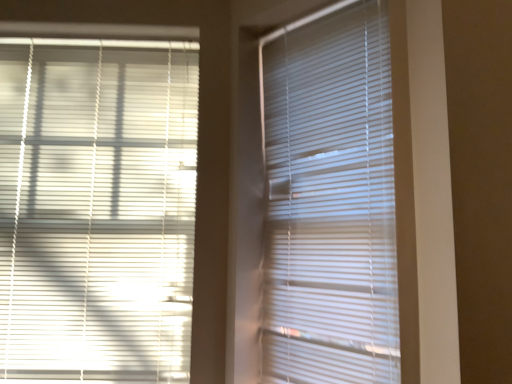
I want to click on white matte blinds at left, the 1th window blind viewed from the left, so click(97, 208).

What do you see at coordinates (97, 208) in the screenshot? I see `white matte blinds at left, the 2th window blind from the right` at bounding box center [97, 208].

How much space does white matte window blind at center, acting as the first window blind starting from the right, occupy horizontally?

It is 0.98 inches.

Locate an element on the screen. The height and width of the screenshot is (384, 512). white matte window blind at center, acting as the first window blind starting from the right is located at coordinates pos(330,201).

How much space does white matte window blind at center, which is counted as the second window blind, starting from the left, occupy vertically?

The height of white matte window blind at center, which is counted as the second window blind, starting from the left, is 5.05 feet.

This screenshot has width=512, height=384. What do you see at coordinates (330, 201) in the screenshot?
I see `white matte window blind at center, acting as the first window blind starting from the right` at bounding box center [330, 201].

At what (x,y) coordinates should I click in order to perform the action: click on white matte blinds at left, the 2th window blind from the right. Please return your answer as a coordinate pair (x, y). The width and height of the screenshot is (512, 384). Looking at the image, I should click on (97, 208).

Which is more to the left, white matte blinds at left, the 2th window blind from the right, or white matte window blind at center, which is counted as the second window blind, starting from the left?

Positioned to the left is white matte blinds at left, the 2th window blind from the right.

In the image, is white matte blinds at left, the 2th window blind from the right, positioned in front of or behind white matte window blind at center, which is counted as the second window blind, starting from the left?

Clearly, white matte blinds at left, the 2th window blind from the right, is behind white matte window blind at center, which is counted as the second window blind, starting from the left.

Considering the positions of point (10, 256) and point (337, 224), is point (10, 256) closer or farther from the camera than point (337, 224)?

Point (10, 256) is positioned farther from the camera compared to point (337, 224).

From the image's perspective, is white matte blinds at left, the 1th window blind viewed from the left, below white matte window blind at center, which is counted as the second window blind, starting from the left?

Indeed, from the image's perspective, white matte blinds at left, the 1th window blind viewed from the left, is shown beneath white matte window blind at center, which is counted as the second window blind, starting from the left.

From a real-world perspective, is white matte blinds at left, the 2th window blind from the right, on white matte window blind at center, acting as the first window blind starting from the right?

No, from a real-world perspective, white matte blinds at left, the 2th window blind from the right, is not above white matte window blind at center, acting as the first window blind starting from the right.

In terms of width, does white matte blinds at left, the 1th window blind viewed from the left, look wider or thinner when compared to white matte window blind at center, which is counted as the second window blind, starting from the left?

In the image, white matte blinds at left, the 1th window blind viewed from the left, appears to be wider than white matte window blind at center, which is counted as the second window blind, starting from the left.

Which of these two, white matte blinds at left, the 1th window blind viewed from the left, or white matte window blind at center, which is counted as the second window blind, starting from the left, stands shorter?

Standing shorter between the two is white matte window blind at center, which is counted as the second window blind, starting from the left.

Can you confirm if white matte blinds at left, the 2th window blind from the right, is bigger than white matte window blind at center, acting as the first window blind starting from the right?

Indeed, white matte blinds at left, the 2th window blind from the right, has a larger size compared to white matte window blind at center, acting as the first window blind starting from the right.

Which is correct: white matte blinds at left, the 2th window blind from the right, is inside white matte window blind at center, which is counted as the second window blind, starting from the left, or outside of it?

white matte blinds at left, the 2th window blind from the right, is outside white matte window blind at center, which is counted as the second window blind, starting from the left.

Is white matte blinds at left, the 1th window blind viewed from the left, next to white matte window blind at center, which is counted as the second window blind, starting from the left?

They are not placed beside each other.

Could you tell me if white matte blinds at left, the 1th window blind viewed from the left, is turned towards white matte window blind at center, acting as the first window blind starting from the right?

No, white matte blinds at left, the 1th window blind viewed from the left, is not turned towards white matte window blind at center, acting as the first window blind starting from the right.

How much distance is there between white matte blinds at left, the 1th window blind viewed from the left, and white matte window blind at center, which is counted as the second window blind, starting from the left?

A: A distance of 28.01 inches exists between white matte blinds at left, the 1th window blind viewed from the left, and white matte window blind at center, which is counted as the second window blind, starting from the left.

Where is `window blind positioned vertically above the white matte blinds at left, the 1th window blind viewed from the left (from a real-world perspective)`? window blind positioned vertically above the white matte blinds at left, the 1th window blind viewed from the left (from a real-world perspective) is located at coordinates click(x=330, y=201).

From the picture: Which is more to the right, white matte window blind at center, which is counted as the second window blind, starting from the left, or white matte blinds at left, the 1th window blind viewed from the left?

From the viewer's perspective, white matte window blind at center, which is counted as the second window blind, starting from the left, appears more on the right side.

Which object is more forward, white matte window blind at center, which is counted as the second window blind, starting from the left, or white matte blinds at left, the 1th window blind viewed from the left?

white matte window blind at center, which is counted as the second window blind, starting from the left.

Considering the points (314, 19) and (27, 297), which point is in front, point (314, 19) or point (27, 297)?

The point (314, 19) is in front.

From the image's perspective, which one is positioned higher, white matte window blind at center, acting as the first window blind starting from the right, or white matte blinds at left, the 2th window blind from the right?

white matte window blind at center, acting as the first window blind starting from the right, is shown above in the image.

From a real-world perspective, between white matte window blind at center, which is counted as the second window blind, starting from the left, and white matte blinds at left, the 2th window blind from the right, who is vertically higher?

In real-world perspective, white matte window blind at center, which is counted as the second window blind, starting from the left, is above.

In terms of width, does white matte window blind at center, which is counted as the second window blind, starting from the left, look wider or thinner when compared to white matte blinds at left, the 1th window blind viewed from the left?

white matte window blind at center, which is counted as the second window blind, starting from the left, is thinner than white matte blinds at left, the 1th window blind viewed from the left.

Considering the relative sizes of white matte window blind at center, acting as the first window blind starting from the right, and white matte blinds at left, the 2th window blind from the right, in the image provided, is white matte window blind at center, acting as the first window blind starting from the right, taller than white matte blinds at left, the 2th window blind from the right,?

Incorrect, the height of white matte window blind at center, acting as the first window blind starting from the right, is not larger of that of white matte blinds at left, the 2th window blind from the right.

Can you confirm if white matte window blind at center, which is counted as the second window blind, starting from the left, is smaller than white matte blinds at left, the 2th window blind from the right?

Correct, white matte window blind at center, which is counted as the second window blind, starting from the left, occupies less space than white matte blinds at left, the 2th window blind from the right.

Is white matte window blind at center, which is counted as the second window blind, starting from the left, inside the boundaries of white matte blinds at left, the 1th window blind viewed from the left, or outside?

The correct answer is: outside.

Are white matte window blind at center, which is counted as the second window blind, starting from the left, and white matte blinds at left, the 2th window blind from the right, far apart?

white matte window blind at center, which is counted as the second window blind, starting from the left, is actually quite close to white matte blinds at left, the 2th window blind from the right.

Is white matte window blind at center, which is counted as the second window blind, starting from the left, oriented towards white matte blinds at left, the 2th window blind from the right?

No, white matte window blind at center, which is counted as the second window blind, starting from the left, is not facing towards white matte blinds at left, the 2th window blind from the right.

The image size is (512, 384). In order to click on window blind above the white matte blinds at left, the 1th window blind viewed from the left (from the image's perspective) in this screenshot , I will do `click(330, 201)`.

Identify the location of window blind on the right of white matte blinds at left, the 1th window blind viewed from the left. This screenshot has width=512, height=384. (330, 201).

Where is `window blind below the white matte window blind at center, acting as the first window blind starting from the right (from a real-world perspective)`? window blind below the white matte window blind at center, acting as the first window blind starting from the right (from a real-world perspective) is located at coordinates (97, 208).